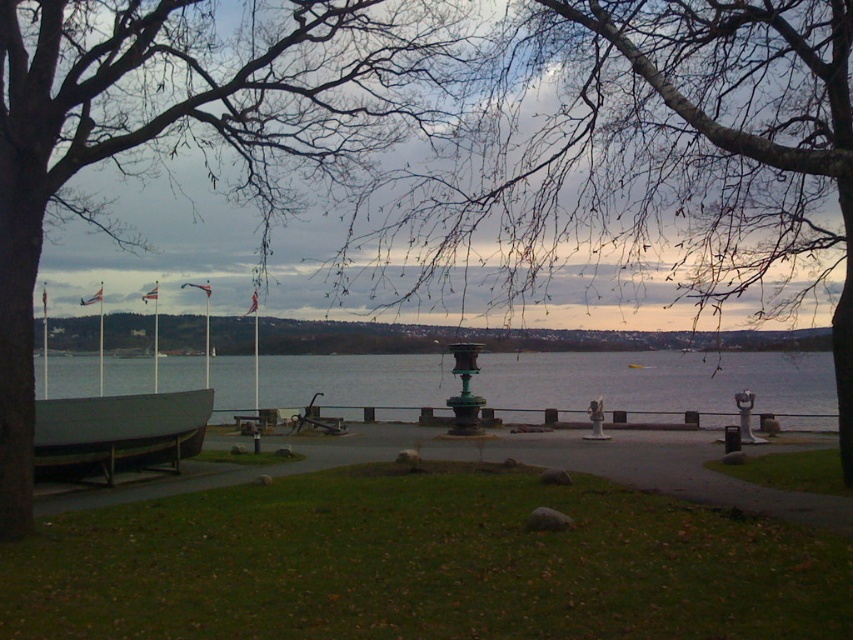
Does point (397, 45) come in front of point (47, 438)?

Yes, point (397, 45) is in front of point (47, 438).

Can you confirm if dark brown bark tree at left is smaller than matte gray boat at lower left?

No.

Measure the distance between dark brown bark tree at left and camera.

dark brown bark tree at left and camera are 11.33 meters apart.

Where is `dark brown bark tree at left`? The image size is (853, 640). dark brown bark tree at left is located at coordinates (194, 124).

Does bare branches at center have a smaller size compared to clear water at center?

No.

Image resolution: width=853 pixels, height=640 pixels. I want to click on bare branches at center, so click(654, 148).

Is point (791, 276) positioned before point (222, 90)?

No, it is not.

Does bare branches at center appear over dark brown bark tree at left?

Incorrect, bare branches at center is not positioned above dark brown bark tree at left.

Locate an element on the screen. bare branches at center is located at coordinates (654, 148).